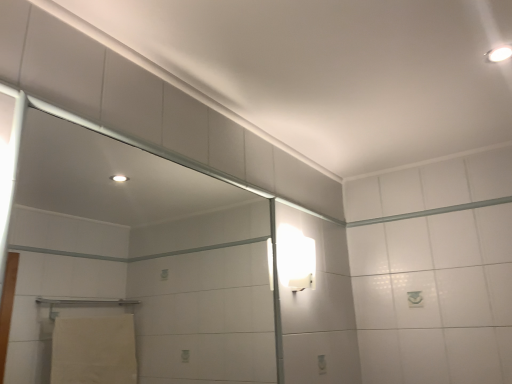
Question: From a real-world perspective, is white glossy wall sconce at upper right, which is counted as the second light fixture, starting from the right, physically above transparent glass screen door at upper left?

Choices:
 (A) no
 (B) yes

Answer: (B)

Question: Can we say white glossy wall sconce at upper right, the 1th light fixture positioned from the back, lies outside transparent glass screen door at upper left?

Choices:
 (A) yes
 (B) no

Answer: (A)

Question: Considering the relative sizes of white glossy wall sconce at upper right, which is counted as the second light fixture, starting from the right, and transparent glass screen door at upper left in the image provided, is white glossy wall sconce at upper right, which is counted as the second light fixture, starting from the right, wider than transparent glass screen door at upper left?

Choices:
 (A) no
 (B) yes

Answer: (B)

Question: Is transparent glass screen door at upper left at the back of white glossy wall sconce at upper right, arranged as the second light fixture when viewed from the top?

Choices:
 (A) no
 (B) yes

Answer: (A)

Question: From the image's perspective, is white glossy wall sconce at upper right, positioned as the first light fixture in bottom-to-top order, above transparent glass screen door at upper left?

Choices:
 (A) yes
 (B) no

Answer: (B)

Question: From the image's perspective, relative to white glossy light fixture at upper right, the first light fixture positioned from the top, is white glossy wall sconce at upper right, which is counted as the second light fixture, starting from the right, above or below?

Choices:
 (A) below
 (B) above

Answer: (A)

Question: Is white glossy wall sconce at upper right, the 1th light fixture positioned from the back, inside the boundaries of white glossy light fixture at upper right, which appears as the 2th light fixture when viewed from the back, or outside?

Choices:
 (A) inside
 (B) outside

Answer: (B)

Question: In terms of width, does white glossy wall sconce at upper right, which is the 1th light fixture from left to right, look wider or thinner when compared to white glossy light fixture at upper right, the 1th light fixture viewed from the right?

Choices:
 (A) wide
 (B) thin

Answer: (B)

Question: Based on their sizes in the image, would you say white glossy wall sconce at upper right, arranged as the second light fixture when viewed from the top, is bigger or smaller than white glossy light fixture at upper right, the first light fixture positioned from the top?

Choices:
 (A) small
 (B) big

Answer: (B)

Question: In terms of size, does transparent glass screen door at upper left appear bigger or smaller than white glossy light fixture at upper right, which is the first light fixture from front to back?

Choices:
 (A) small
 (B) big

Answer: (B)

Question: From the image's perspective, is transparent glass screen door at upper left located above or below white glossy light fixture at upper right, the 1th light fixture viewed from the right?

Choices:
 (A) above
 (B) below

Answer: (B)

Question: Considering the positions of transparent glass screen door at upper left and white glossy light fixture at upper right, which appears as the 2th light fixture when viewed from the back, in the image, is transparent glass screen door at upper left wider or thinner than white glossy light fixture at upper right, which appears as the 2th light fixture when viewed from the back,?

Choices:
 (A) wide
 (B) thin

Answer: (B)

Question: Is transparent glass screen door at upper left taller or shorter than white glossy light fixture at upper right, the second light fixture from the bottom?

Choices:
 (A) short
 (B) tall

Answer: (B)

Question: Is point (287, 268) closer or farther from the camera than point (125, 274)?

Choices:
 (A) farther
 (B) closer

Answer: (B)

Question: From a real-world perspective, is white glossy wall sconce at upper right, the 1th light fixture positioned from the back, above or below transparent glass screen door at upper left?

Choices:
 (A) below
 (B) above

Answer: (B)